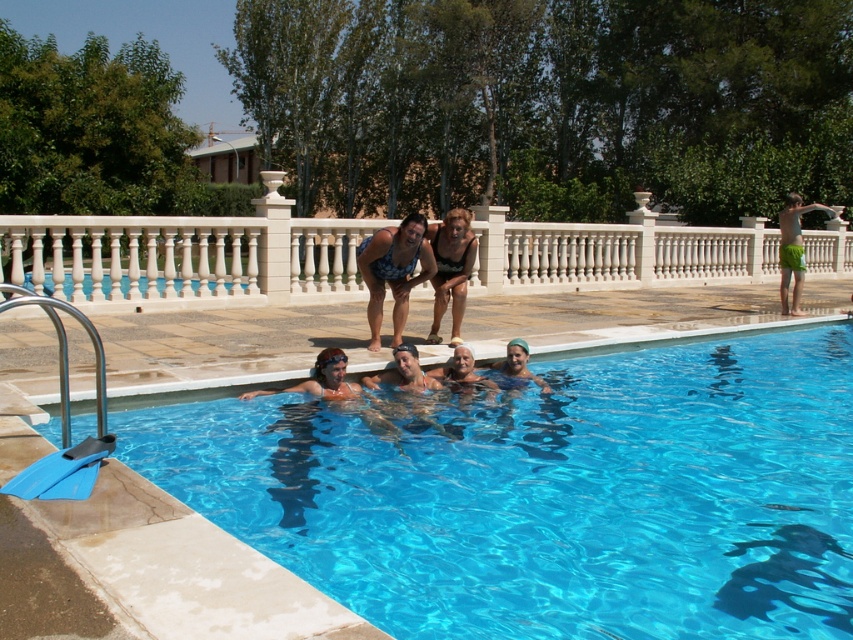
Question: Which point is farther to the camera?

Choices:
 (A) (791, 237)
 (B) (332, 355)
 (C) (357, 260)

Answer: (A)

Question: Does transparent blue water at center have a smaller size compared to blue swimsuit at upper center?

Choices:
 (A) yes
 (B) no

Answer: (A)

Question: Is transparent blue water at center bigger than blue swimsuit at upper center?

Choices:
 (A) yes
 (B) no

Answer: (B)

Question: Considering the real-world distances, which object is farthest from the blue swimsuit at upper center?

Choices:
 (A) green fabric shorts at right
 (B) clear plastic goggles at upper center
 (C) matte black swimsuit at center

Answer: (A)

Question: Estimate the real-world distances between objects in this image. Which object is farther from the transparent blue water at center?

Choices:
 (A) blue swimsuit at upper center
 (B) matte black swimsuit at center

Answer: (B)

Question: Does matte black swimsuit at center have a larger size compared to green fabric shorts at right?

Choices:
 (A) no
 (B) yes

Answer: (A)